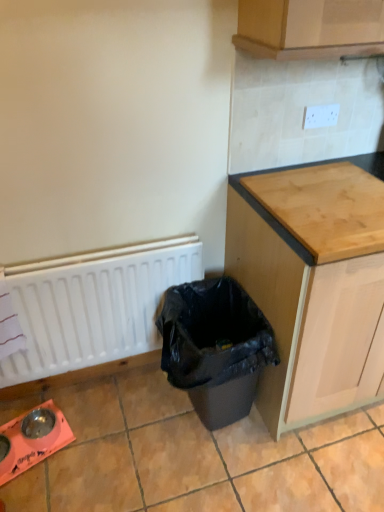
This screenshot has width=384, height=512. Find the location of `vacant region in front of white matte radiator at lower left`. vacant region in front of white matte radiator at lower left is located at coordinates (106, 442).